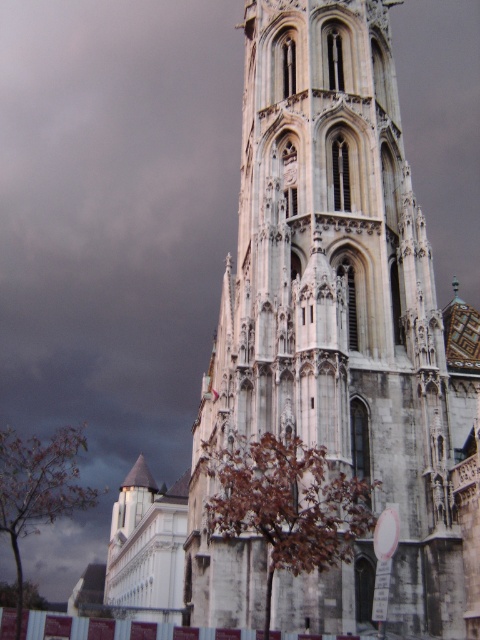
You are an architect planning to build a replica of the white stone tower at center. You notice a brown leafy tree at lower left nearby. Considering their widths, which structure is narrower?

The white stone tower at center is narrower than the brown leafy tree at lower left.

You are standing in a field and see the white stone tower at center and the brown leafy tree at lower left. Which object is taller?

The white stone tower at center is taller than the brown leafy tree at lower left according to the description.